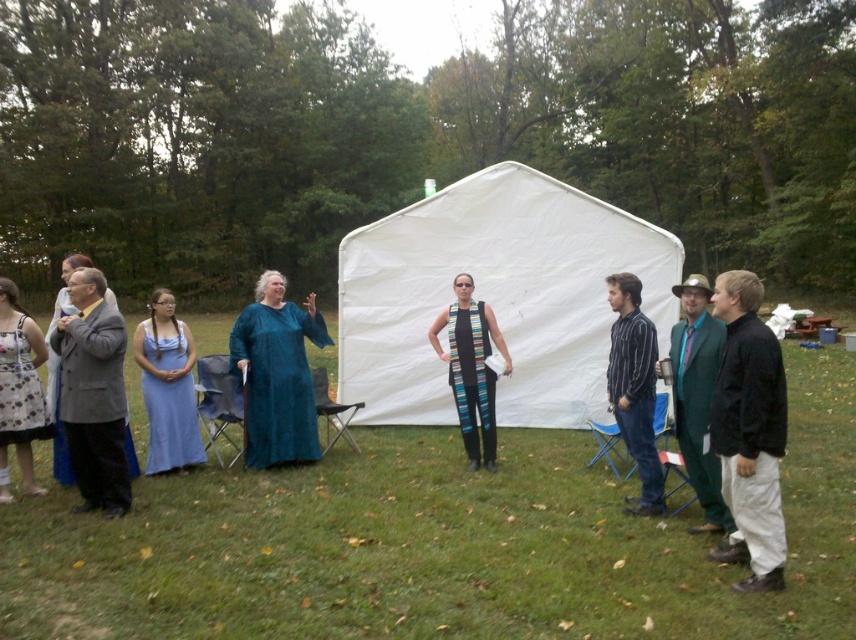
Consider the image. You are standing at the center of the image where the white tent is located. You want to go to the gray wool suit at left. Which direction should you face to walk directly towards it?

You should face towards the left direction to walk directly towards the gray wool suit at left since it is located at point (93, 394) which is to the left of the center.

You are standing at the center of the scene and want to place a new picnic blanket. The picnic blanket must be placed at point (749, 432). What object is already located there?

The black matte jacket at lower right is already located at point (749, 432).